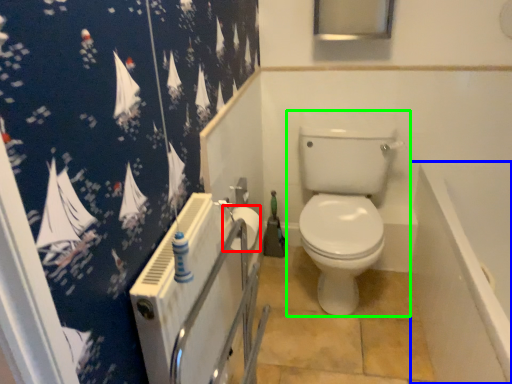
Question: Based on their relative distances, which object is nearer to toilet paper (highlighted by a red box)? Choose from bath (highlighted by a blue box) and toilet (highlighted by a green box).

Choices:
 (A) bath
 (B) toilet

Answer: (B)